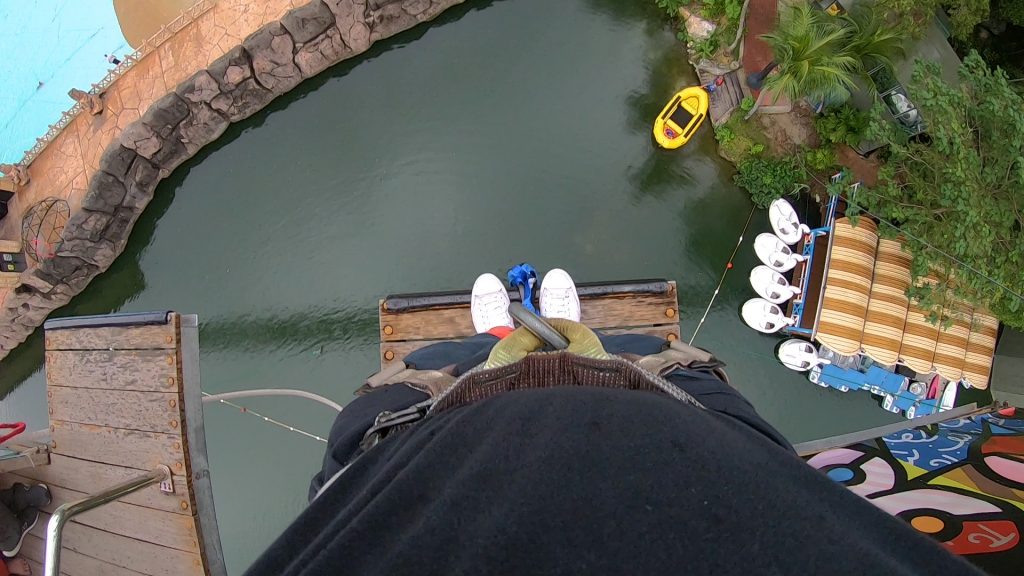
Locate an element on the screen. This screenshot has height=576, width=1024. metallic rail is located at coordinates (122, 491).